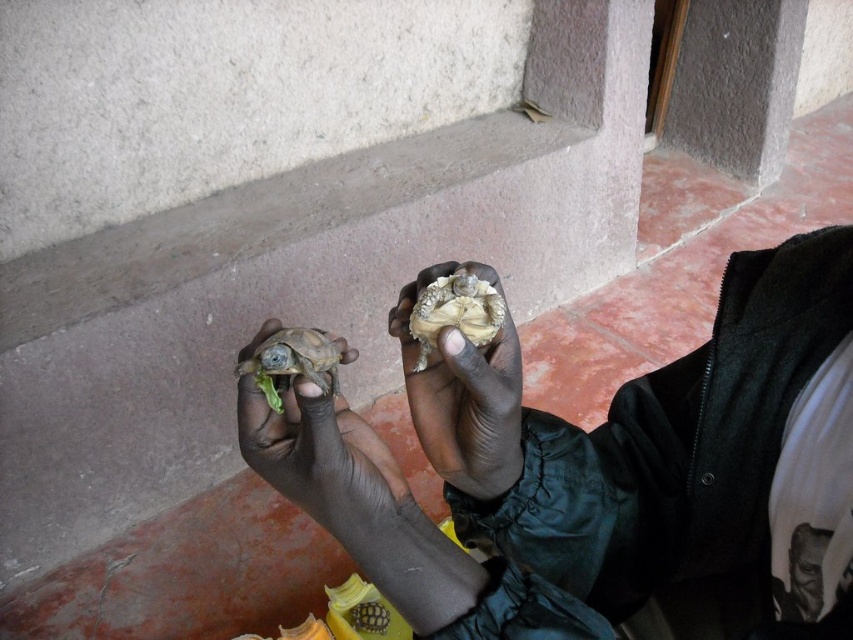
Is point (445, 406) more distant than point (363, 461)?

Yes, point (445, 406) is behind point (363, 461).

Is smooth brown tortoise at center closer to the viewer compared to brown matte turtle at center?

No, smooth brown tortoise at center is behind brown matte turtle at center.

Image resolution: width=853 pixels, height=640 pixels. What do you see at coordinates (463, 396) in the screenshot?
I see `smooth brown tortoise at center` at bounding box center [463, 396].

At what (x,y) coordinates should I click in order to perform the action: click on smooth brown tortoise at center. Please return your answer as a coordinate pair (x, y). The width and height of the screenshot is (853, 640). Looking at the image, I should click on (463, 396).

Is smooth brown turtle at center above smooth brown tortoise at center?

Incorrect, smooth brown turtle at center is not positioned above smooth brown tortoise at center.

Who is positioned more to the right, smooth brown turtle at center or smooth brown tortoise at center?

Positioned to the right is smooth brown turtle at center.

Image resolution: width=853 pixels, height=640 pixels. In order to click on smooth brown turtle at center in this screenshot , I will do `click(601, 467)`.

Who is positioned more to the left, brown matte turtle at center or light brown textured shell at center?

Positioned to the left is brown matte turtle at center.

Which is behind, point (288, 416) or point (426, 324)?

The point (288, 416) is behind.

Locate an element on the screen. This screenshot has height=640, width=853. brown matte turtle at center is located at coordinates (318, 454).